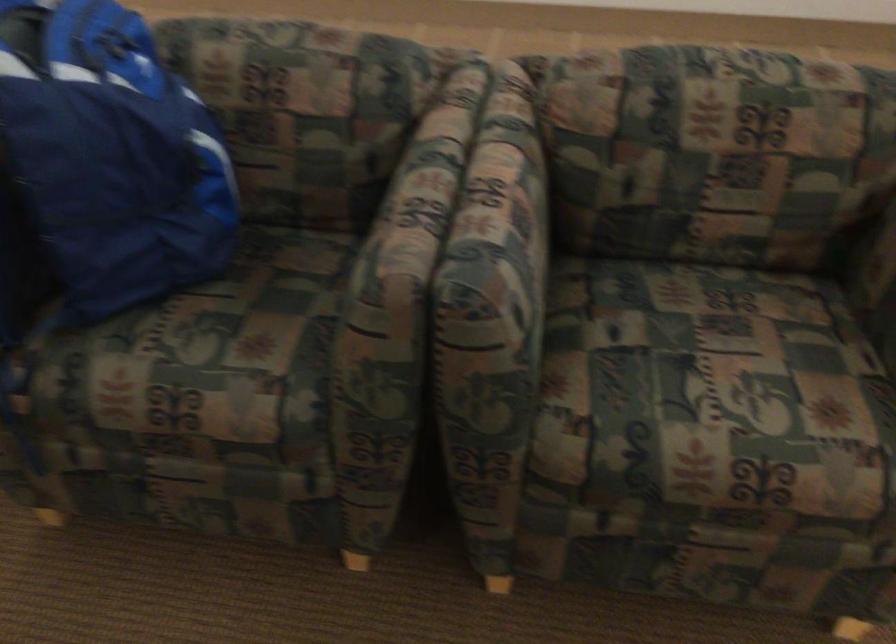
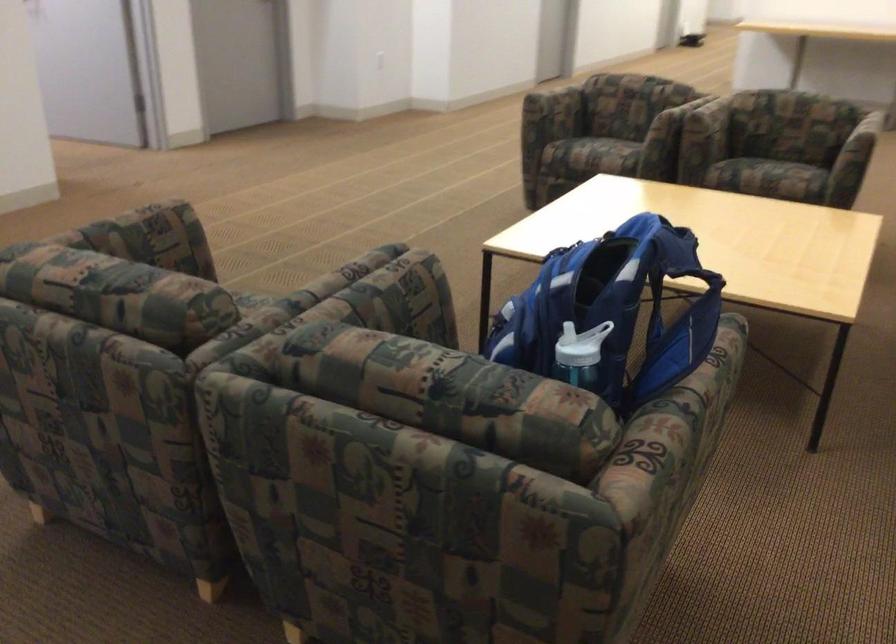
In the second image, find the point that corresponds to point 769,402 in the first image.

(250, 298)